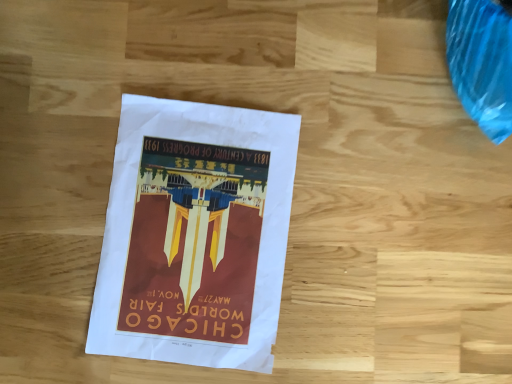
The height and width of the screenshot is (384, 512). Identify the location of free location above matte paper poster at center (from a real-world perspective). (189, 223).